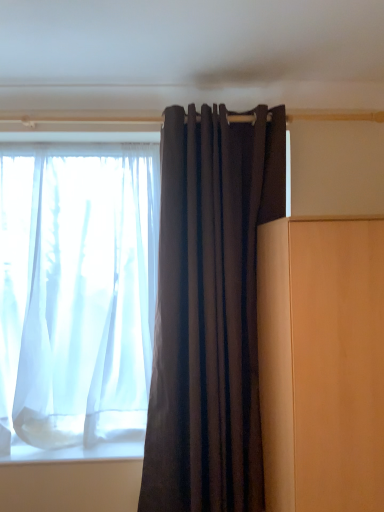
Question: From the image's perspective, is sheer white curtain at left, which is counted as the 1th curtain, starting from the back, above or below matte wood cabinet at right?

Choices:
 (A) above
 (B) below

Answer: (A)

Question: Is point 125,368 closer or farther from the camera than point 354,241?

Choices:
 (A) farther
 (B) closer

Answer: (A)

Question: Which of these objects is positioned closest to the matte wood cabinet at right?

Choices:
 (A) sheer white curtain at left, which ranks as the second curtain in right-to-left order
 (B) dark matte fabric curtain at center, the first curtain positioned from the front

Answer: (B)

Question: Which is nearer to the dark matte fabric curtain at center, which is the first curtain in right-to-left order?

Choices:
 (A) sheer white curtain at left, which is counted as the 1th curtain, starting from the back
 (B) matte wood cabinet at right

Answer: (A)